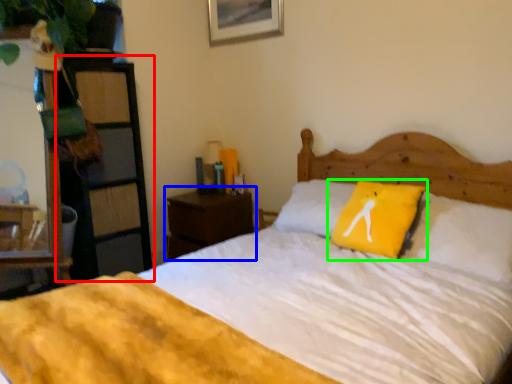
Question: Which object is the farthest from dresser (highlighted by a red box)? Choose among these: nightstand (highlighted by a blue box) or pillow (highlighted by a green box).

Choices:
 (A) nightstand
 (B) pillow

Answer: (B)